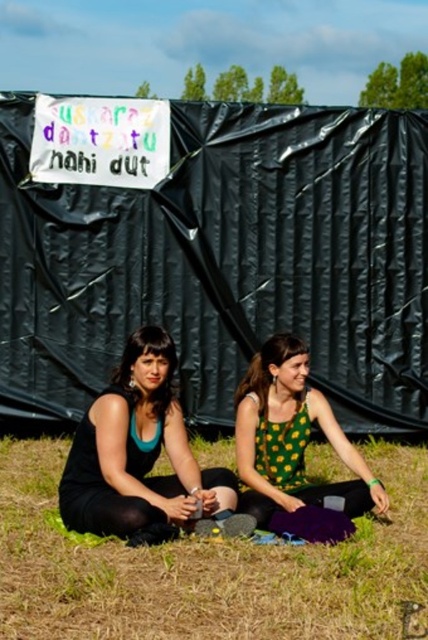
You are organizing a photoshoot and need to ensure that the two models are positioned so that their outfits are clearly visible. Given that the matte black tank top at center and the green dotted dress at center are part of the setup, which outfit takes up more horizontal space in the image?

The green dotted dress at center takes up more horizontal space than the matte black tank top at center because the matte black tank top at center has a lesser width compared to green dotted dress at center.

Based on the scene, can you determine if the green grass at lower center is taller than the black matte tank top at center?

The green grass at lower center is not as tall as the black matte tank top at center, so the grass is shorter than the tank top.

You are a photographer setting up for a photo shoot. You have two points marked on the tarp as reference points for lighting placement. The first point is at coordinates point (x=211, y=452) and the second is at point (x=89, y=420). Which point is closer to the camera?

Point (x=211, y=452) is further to the camera than point (x=89, y=420), so the point closer to the camera is point (x=89, y=420).